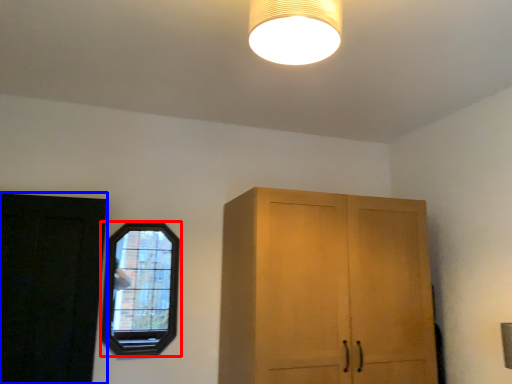
Question: Among these objects, which one is farthest to the camera, window (highlighted by a red box) or door (highlighted by a blue box)?

Choices:
 (A) window
 (B) door

Answer: (A)